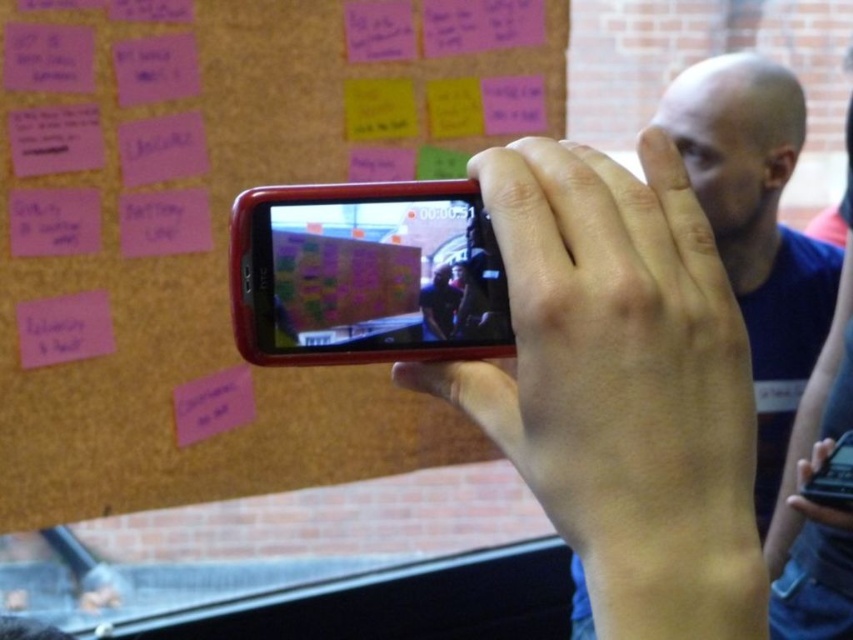
You are looking at the phone screen and see two points marked on the screen. The first point is at coordinates point (186, 285) and the second is at point (250, 252). Which point appears closer to you on the screen?

Point (186, 285) is further to the viewer than point (250, 252), so the second point appears closer to you on the screen.

You are a photographer trying to capture a clear photo of the bald head at center using the matte black phone at center. What is the minimum distance you need to maintain between the phone and the bald head to ensure the photo is in focus?

The minimum distance required to maintain between the matte black phone at center and the bald head at center to ensure the photo is in focus is 1.25 meters, as they are currently 1.25 meters apart.